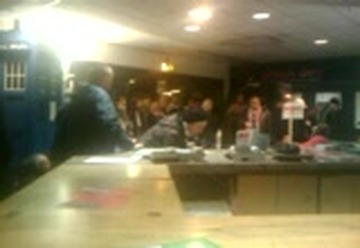
I want to click on cupboard door, so click(255, 192), click(289, 193), click(335, 190).